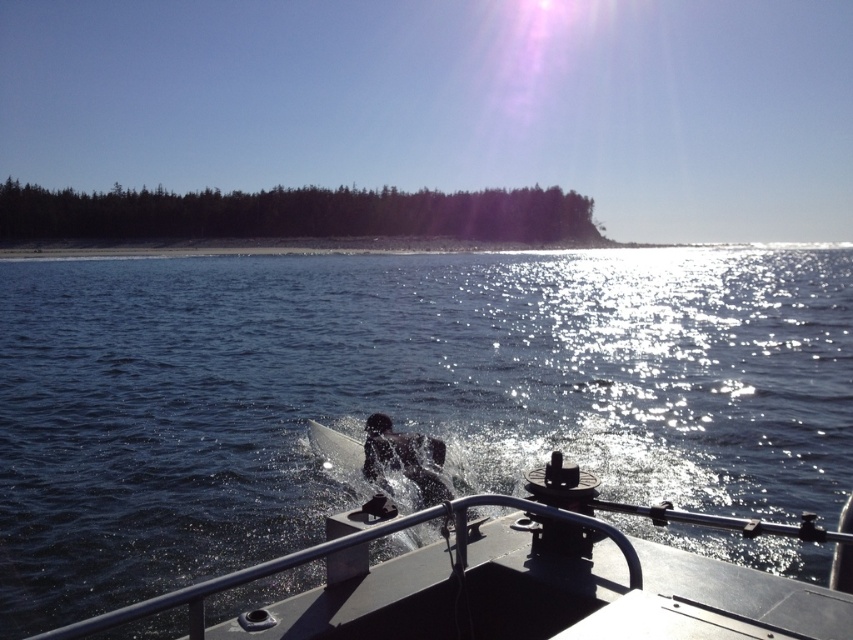
Question: Is dark blue water at center thinner than metallic gray boat at center?

Choices:
 (A) yes
 (B) no

Answer: (B)

Question: Which of the following is the closest to the observer?

Choices:
 (A) (569, 538)
 (B) (186, 339)

Answer: (A)

Question: Is dark blue water at center positioned at the back of metallic gray boat at center?

Choices:
 (A) yes
 (B) no

Answer: (A)

Question: Is dark blue water at center to the left of metallic gray boat at center from the viewer's perspective?

Choices:
 (A) yes
 (B) no

Answer: (A)

Question: Which point is closer to the camera taking this photo?

Choices:
 (A) (666, 636)
 (B) (685, 547)

Answer: (A)